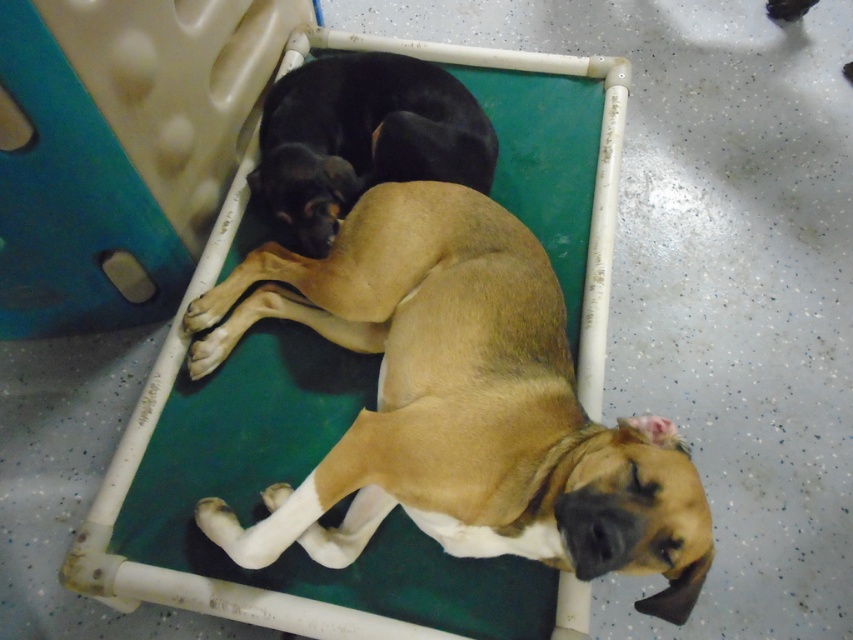
You are a dog owner who wants to ensure both dogs have enough space to rest comfortably. Given the size difference between the brown smooth dog at center and the black fur dog at center, which dog requires more space on the bed?

The brown smooth dog at center requires more space on the bed because it is larger in size than the black fur dog at center.

You are a dog owner who wants to ensure both dogs have enough space to stretch comfortably. Given that each dog requires at least 12 inches of personal space, can the brown smooth dog at center and the black fur dog at center maintain their required space while resting on the makeshift bed?

The distance between the brown smooth dog at center and the black fur dog at center is 11.43 inches, which is less than the required 12 inches of personal space. Therefore, they cannot maintain their required space while resting on the makeshift bed.

You are a veterinarian examining the image of two dogs resting on a makeshift bed. The bed is made of white PVC pipes and a green mat on a gray floor. You need to locate the brown smooth dog at center. According to the coordinates provided, where exactly is it positioned?

The brown smooth dog at center is located at point (457, 404), which means it is positioned towards the right side and slightly above the center of the image.